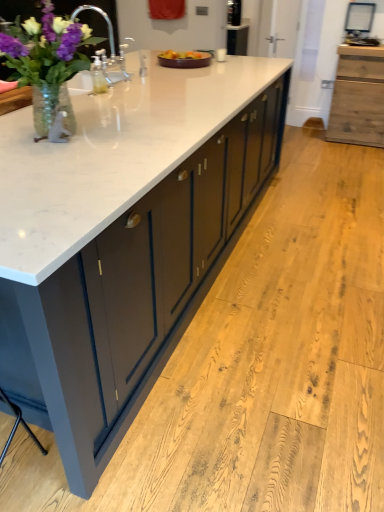
Question: Is brown ceramic tray at center oriented away from white glossy sink at upper left?

Choices:
 (A) yes
 (B) no

Answer: (B)

Question: Does brown ceramic tray at center have a lesser height compared to white glossy sink at upper left?

Choices:
 (A) no
 (B) yes

Answer: (B)

Question: Can you confirm if brown ceramic tray at center is thinner than white glossy sink at upper left?

Choices:
 (A) no
 (B) yes

Answer: (A)

Question: Is brown ceramic tray at center oriented towards white glossy sink at upper left?

Choices:
 (A) yes
 (B) no

Answer: (B)

Question: Does brown ceramic tray at center lie in front of white glossy sink at upper left?

Choices:
 (A) yes
 (B) no

Answer: (B)

Question: In terms of width, does white glossy sink at upper left look wider or thinner when compared to clear glass vase at left?

Choices:
 (A) wide
 (B) thin

Answer: (B)

Question: Is white glossy sink at upper left inside or outside of clear glass vase at left?

Choices:
 (A) outside
 (B) inside

Answer: (A)

Question: Relative to clear glass vase at left, is white glossy sink at upper left in front or behind?

Choices:
 (A) behind
 (B) front

Answer: (A)

Question: From the image's perspective, relative to clear glass vase at left, is white glossy sink at upper left above or below?

Choices:
 (A) above
 (B) below

Answer: (A)

Question: Relative to clear glass vase at left, is white marble countertop at center in front or behind?

Choices:
 (A) behind
 (B) front

Answer: (B)

Question: In terms of size, does white marble countertop at center appear bigger or smaller than clear glass vase at left?

Choices:
 (A) small
 (B) big

Answer: (B)

Question: From their relative heights in the image, would you say white marble countertop at center is taller or shorter than clear glass vase at left?

Choices:
 (A) short
 (B) tall

Answer: (B)

Question: From a real-world perspective, relative to clear glass vase at left, is white marble countertop at center vertically above or below?

Choices:
 (A) above
 (B) below

Answer: (B)

Question: From the image's perspective, is wooden cabinet at right positioned above or below white marble countertop at center?

Choices:
 (A) above
 (B) below

Answer: (A)

Question: From a real-world perspective, is wooden cabinet at right positioned above or below white marble countertop at center?

Choices:
 (A) below
 (B) above

Answer: (A)